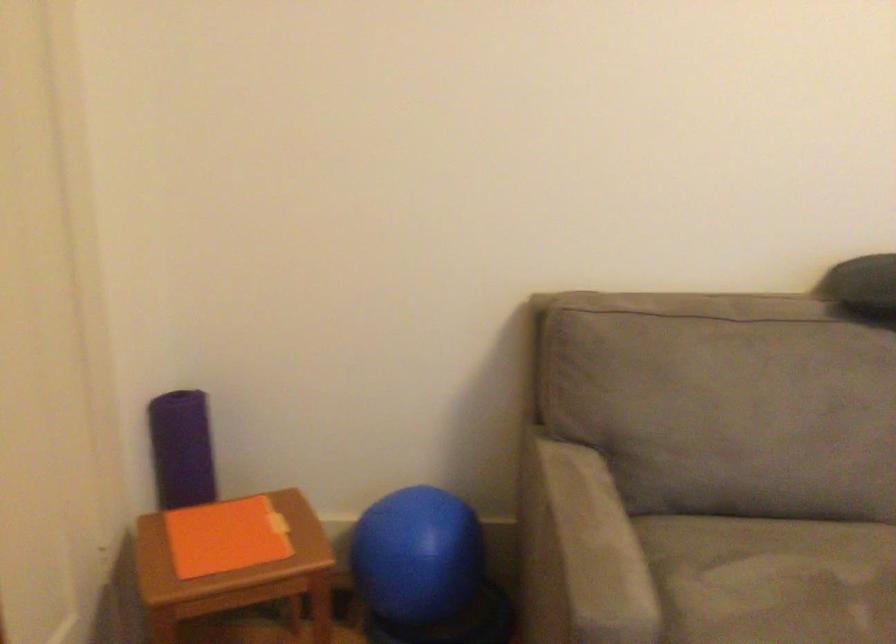
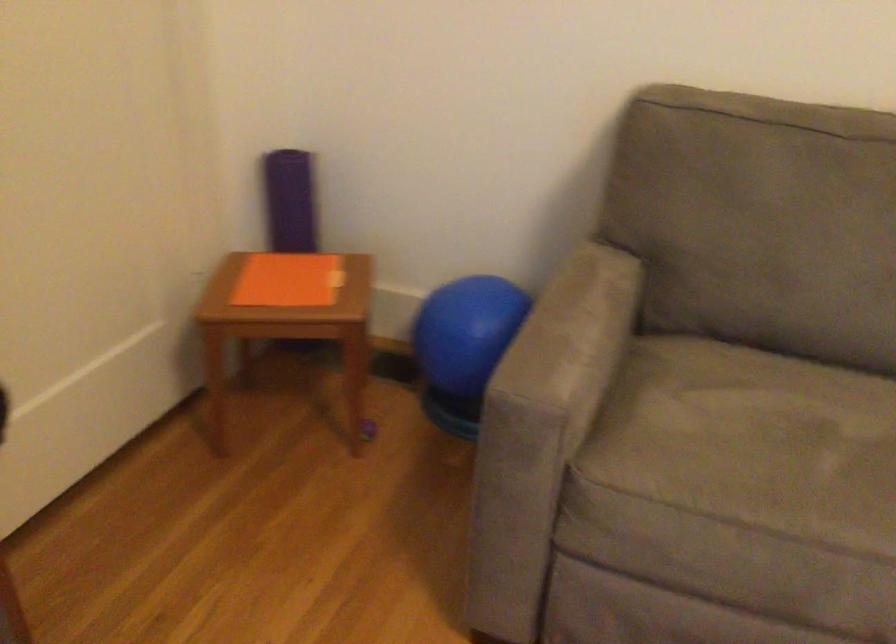
Find the pixel in the second image that matches the point at 231,536 in the first image.

(288, 279)